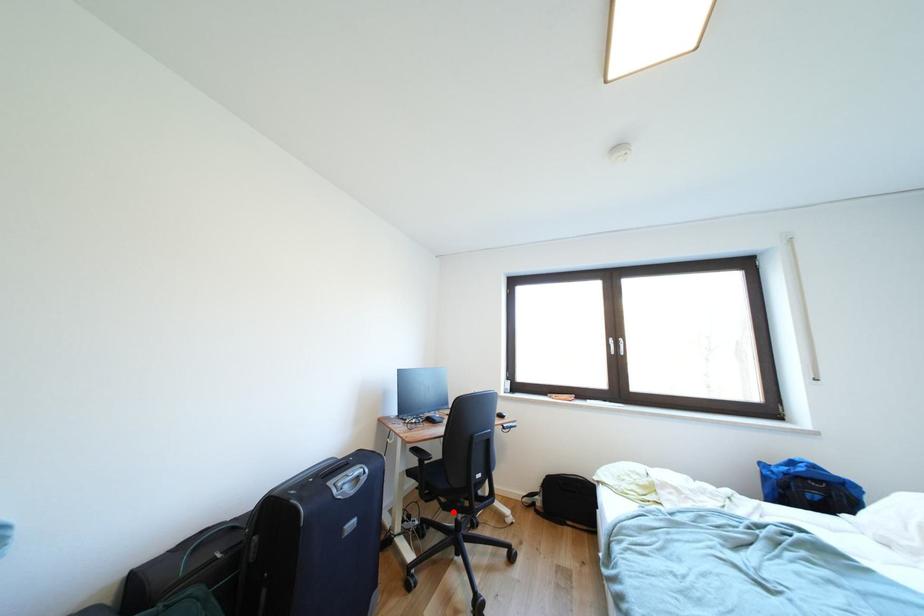
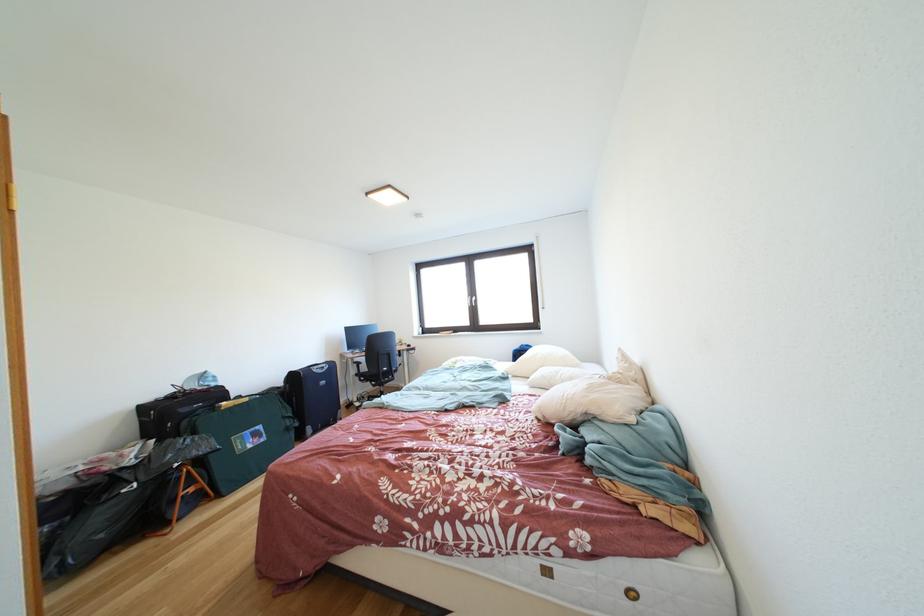
Locate, in the second image, the point that corresponds to the highlighted location in the first image.

(383, 391)